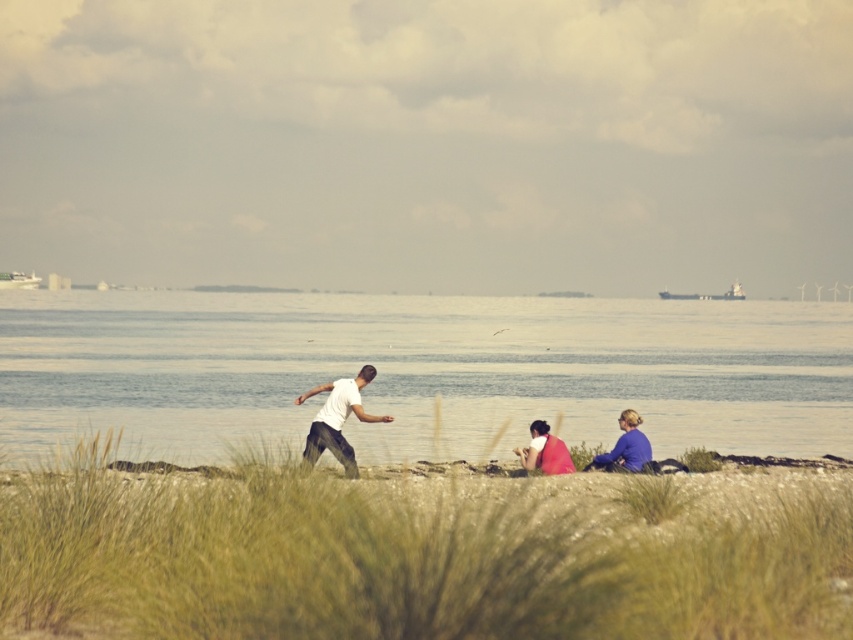
Can you confirm if clear blue water at center is positioned below matte red shirt at center?

Incorrect, clear blue water at center is not positioned below matte red shirt at center.

Where is `clear blue water at center`? This screenshot has height=640, width=853. clear blue water at center is located at coordinates coord(421,371).

The width and height of the screenshot is (853, 640). In order to click on clear blue water at center in this screenshot , I will do `click(421, 371)`.

Is clear blue water at center wider than white matte shirt at center?

Correct, the width of clear blue water at center exceeds that of white matte shirt at center.

In the scene shown: Measure the distance between clear blue water at center and camera.

clear blue water at center is 57.44 feet from camera.

Identify the location of clear blue water at center. (421, 371).

Locate an element on the screen. white matte shirt at center is located at coordinates (337, 419).

Is point (318, 444) positioned after point (622, 440)?

No, (318, 444) is in front of (622, 440).

Locate an element on the screen. The height and width of the screenshot is (640, 853). white matte shirt at center is located at coordinates (337, 419).